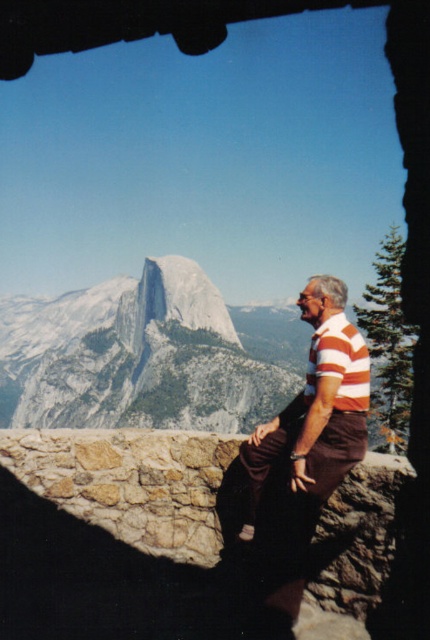
Question: Is striped cotton shirt at right above orange striped polo shirt at center?

Choices:
 (A) yes
 (B) no

Answer: (A)

Question: Is striped cotton shirt at right to the left of orange striped polo shirt at center from the viewer's perspective?

Choices:
 (A) no
 (B) yes

Answer: (B)

Question: In this image, where is striped cotton shirt at right located relative to orange striped polo shirt at center?

Choices:
 (A) left
 (B) right

Answer: (A)

Question: Among these points, which one is farthest from the camera?

Choices:
 (A) (344, 387)
 (B) (352, 436)

Answer: (A)